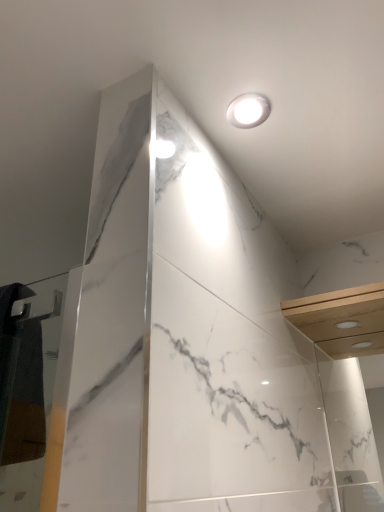
Where is `space that is in front of white glossy light fixture at upper center`? space that is in front of white glossy light fixture at upper center is located at coordinates (259, 50).